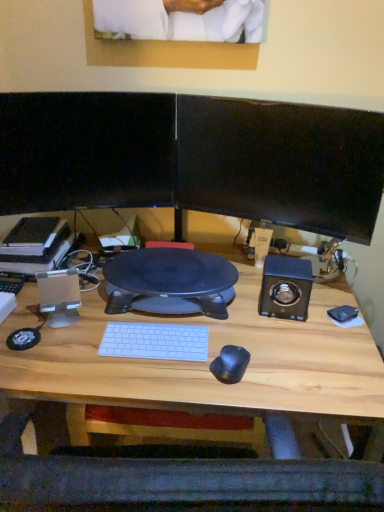
Question: From their relative heights in the image, would you say black glossy monitor at upper right, which appears as the 1th computer monitor when viewed from the right, is taller or shorter than black glossy monitor at upper left, positioned as the first computer monitor in left-to-right order?

Choices:
 (A) tall
 (B) short

Answer: (B)

Question: From the image's perspective, relative to black glossy monitor at upper left, which is the 2th computer monitor from right to left, is black glossy monitor at upper right, which appears as the 1th computer monitor when viewed from the right, above or below?

Choices:
 (A) below
 (B) above

Answer: (A)

Question: Which is farther from the wooden desk at center?

Choices:
 (A) black glossy monitor at upper left, positioned as the first computer monitor in left-to-right order
 (B) black glossy monitor at upper right, which is the second computer monitor from left to right

Answer: (A)

Question: Which object is the closest to the wooden desk at center?

Choices:
 (A) black glossy monitor at upper left, positioned as the first computer monitor in left-to-right order
 (B) black glossy monitor at upper right, which appears as the 1th computer monitor when viewed from the right

Answer: (B)